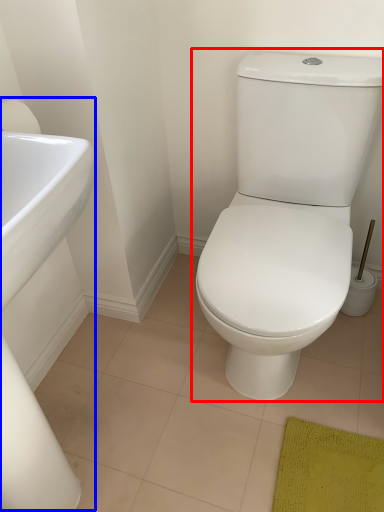
Question: Which point is closer to the camera, toilet (highlighted by a red box) or sink (highlighted by a blue box)?

Choices:
 (A) toilet
 (B) sink

Answer: (B)